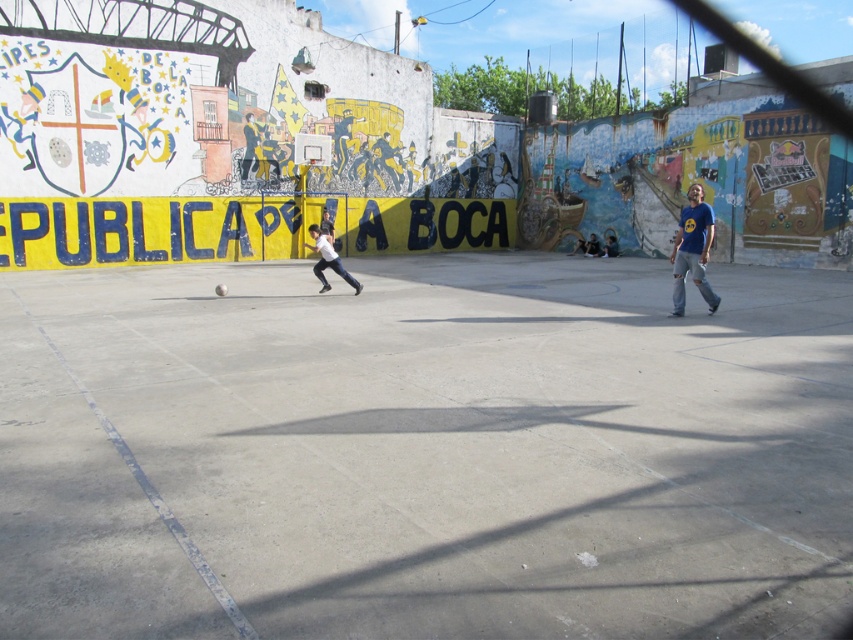
In the scene shown: You are standing on the basketball court and see the concrete at center and the white matte skateboard at center. Which object is positioned to the right of the other?

The concrete at center is to the right of the white matte skateboard at center.